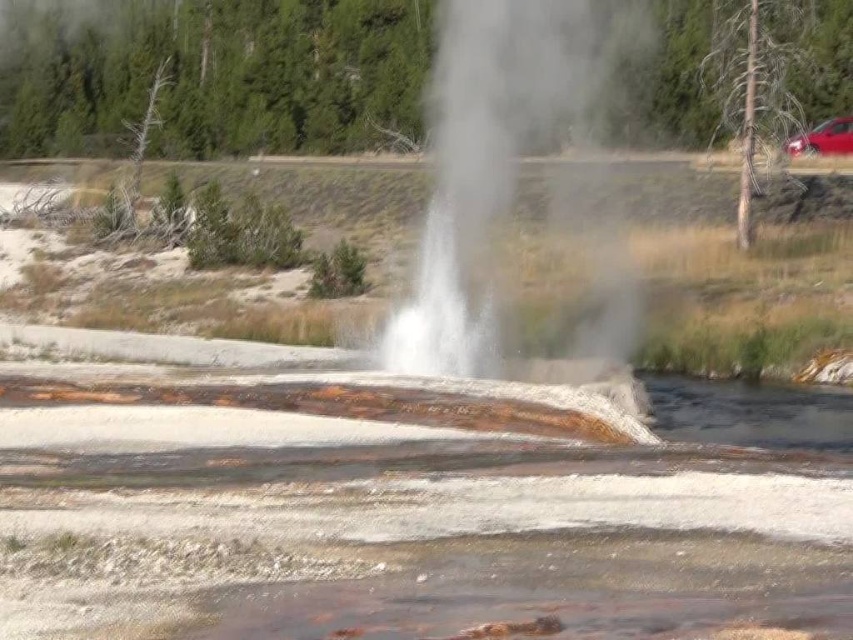
Can you confirm if white vapor at center is taller than metallic red car at right?

Yes.

What do you see at coordinates (483, 168) in the screenshot? I see `white vapor at center` at bounding box center [483, 168].

Which is in front, point (467, 20) or point (801, 140)?

Point (467, 20) is more forward.

Image resolution: width=853 pixels, height=640 pixels. Identify the location of white vapor at center. (483, 168).

What do you see at coordinates (392, 522) in the screenshot? This screenshot has width=853, height=640. I see `white textured water at center` at bounding box center [392, 522].

Can you confirm if white textured water at center is positioned above metallic red car at right?

No, white textured water at center is not above metallic red car at right.

The height and width of the screenshot is (640, 853). Describe the element at coordinates (392, 522) in the screenshot. I see `white textured water at center` at that location.

Where is `white textured water at center`? white textured water at center is located at coordinates (392, 522).

Does white textured water at center come behind white vapor at center?

No, white textured water at center is closer to the viewer.

Which of these two, white textured water at center or white vapor at center, stands shorter?

With less height is white textured water at center.

Where is `white textured water at center`? This screenshot has height=640, width=853. white textured water at center is located at coordinates (392, 522).